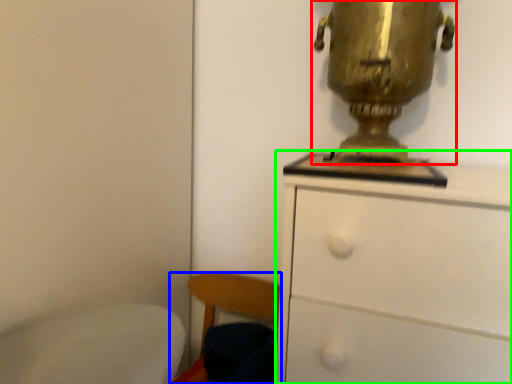
Question: Which is farther away from table lamp (highlighted by a red box)? chair (highlighted by a blue box) or chest of drawers (highlighted by a green box)?

Choices:
 (A) chair
 (B) chest of drawers

Answer: (A)